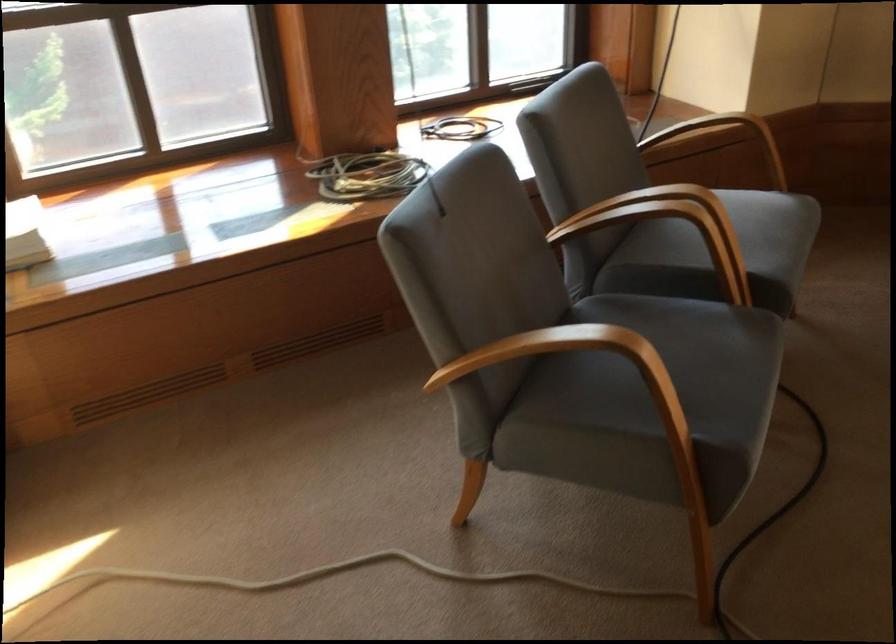
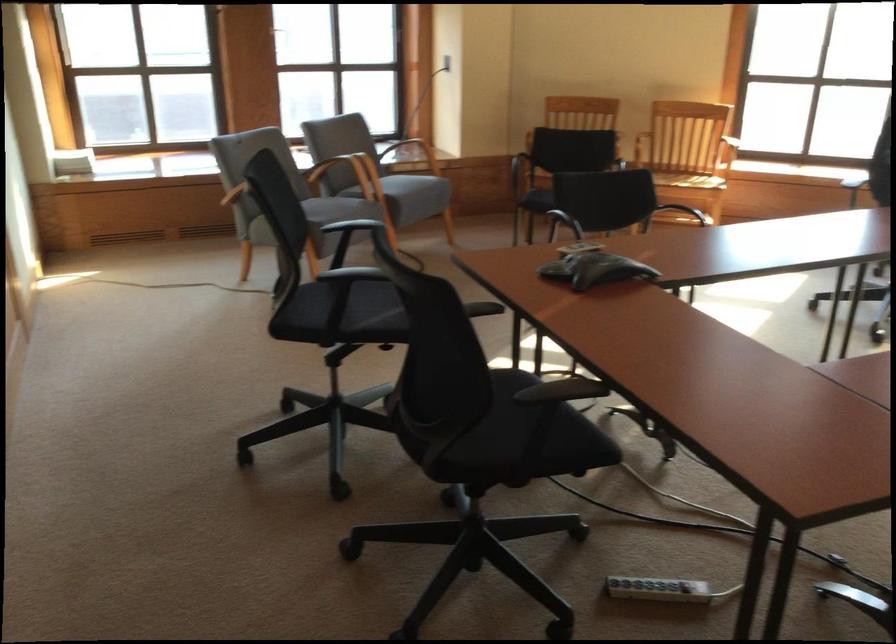
Question: I am providing you with two images of the same scene from different viewpoints. After the viewpoint changes to image2, which objects are now occluded?

Choices:
 (A) black chair sitting surface
 (B) black chair armrest
 (C) wooden chair armrest
 (D) mouse scroll wheel

Answer: (C)